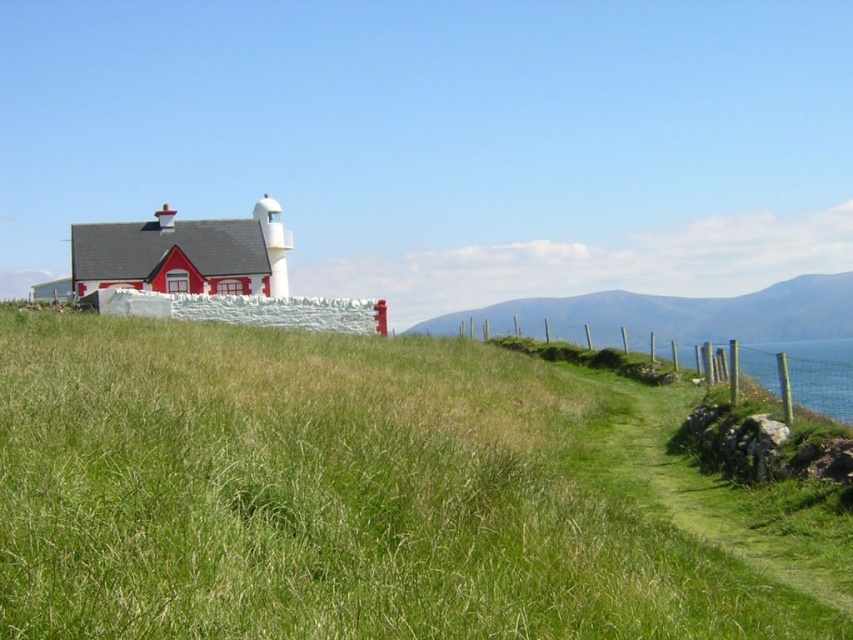
Consider the image. You are standing at the camera position looking at the scene. There are two points marked in the image, one at coordinates point (244,560) and another at point (828,328). Which point is closer to you?

Point (244,560) is closer to the camera than point (828,328).

You are a photographer standing at the edge of the field with a camera. You want to capture a photo of the green grassy area at center. The camera requires a minimum distance of 3 meters to focus properly. Will you be able to take a clear photo of the green grassy at center?

The distance between the green grassy at center and the camera is 3.11 meters, which is above the minimum required 3 meters. Therefore, you can take a clear photo of the green grassy at center.